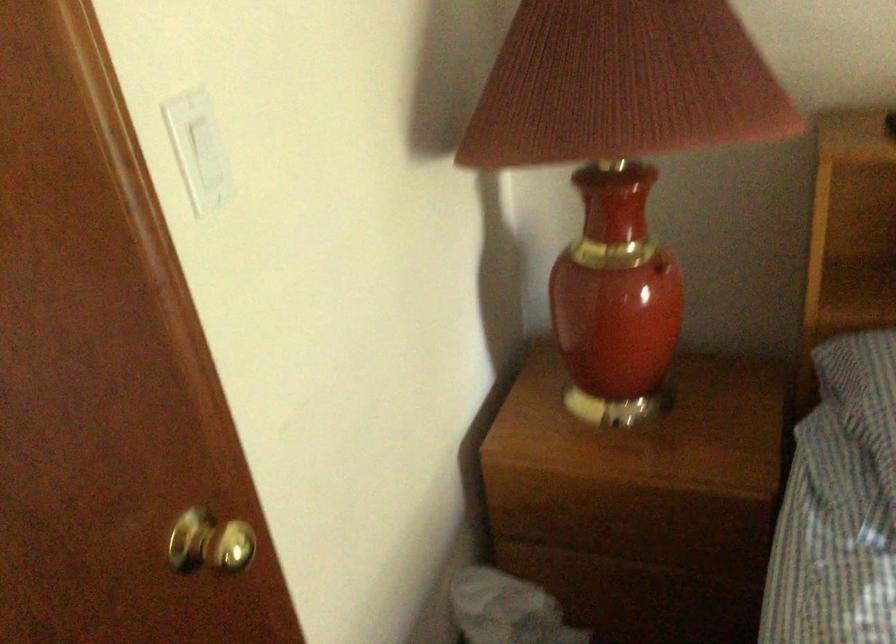
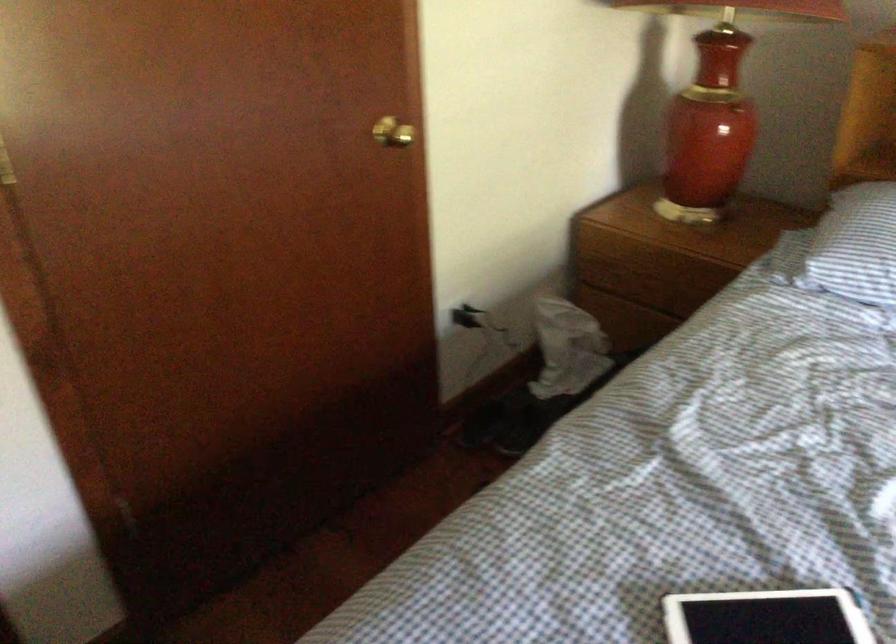
The point at (616,532) is marked in the first image. Where is the corresponding point in the second image?

(650, 283)